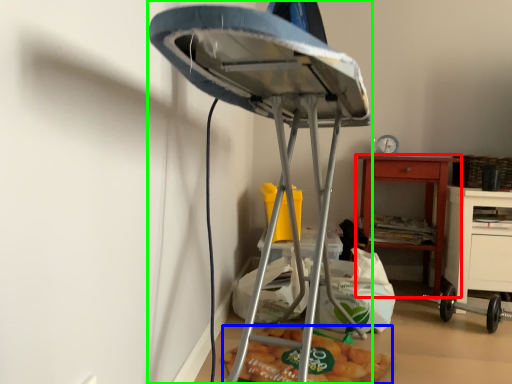
Question: Considering the real-world distances, which object is closest to nightstand (highlighted by a red box)? food (highlighted by a blue box) or furniture (highlighted by a green box).

Choices:
 (A) food
 (B) furniture

Answer: (A)